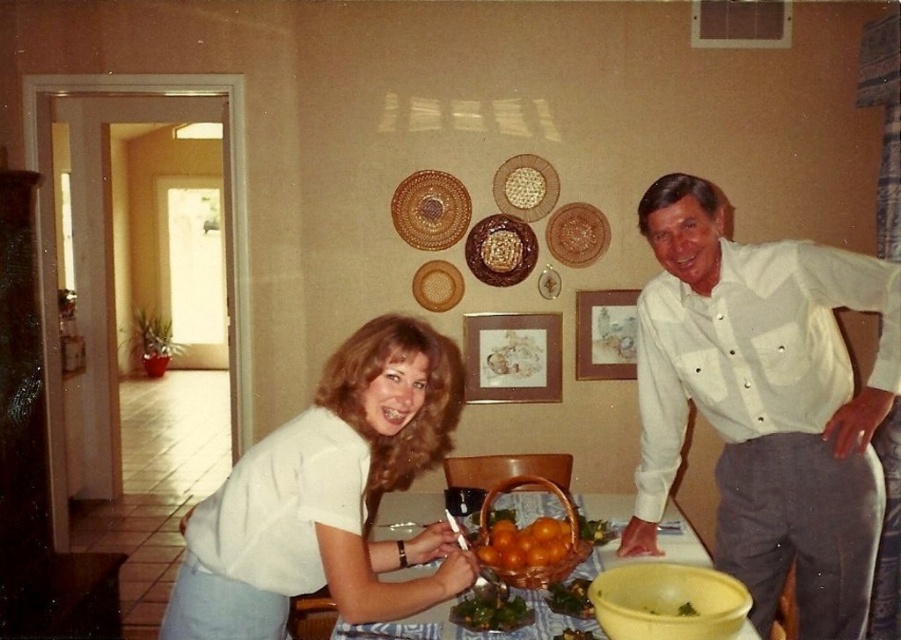
Question: Can you confirm if white matte shirt at center is smaller than matte brown platter at center?

Choices:
 (A) yes
 (B) no

Answer: (B)

Question: Is white cotton shirt at center closer to the viewer compared to orange matte basket at center?

Choices:
 (A) no
 (B) yes

Answer: (B)

Question: Where is green leafy salad at lower center located in relation to matte brown platter at center in the image?

Choices:
 (A) left
 (B) right

Answer: (B)

Question: Which of the following is the farthest from the observer?

Choices:
 (A) (423, 570)
 (B) (647, 476)

Answer: (B)

Question: Which object appears closest to the camera in this image?

Choices:
 (A) woven brown basket at upper center
 (B) white cotton shirt at center
 (C) brown woven basket at center
 (D) matte brown platter at center

Answer: (B)

Question: Which point is closer to the camera?

Choices:
 (A) white matte shirt at center
 (B) woven brown basket at upper center
 (C) white textured shirt at right
 (D) matte brown platter at center

Answer: (A)